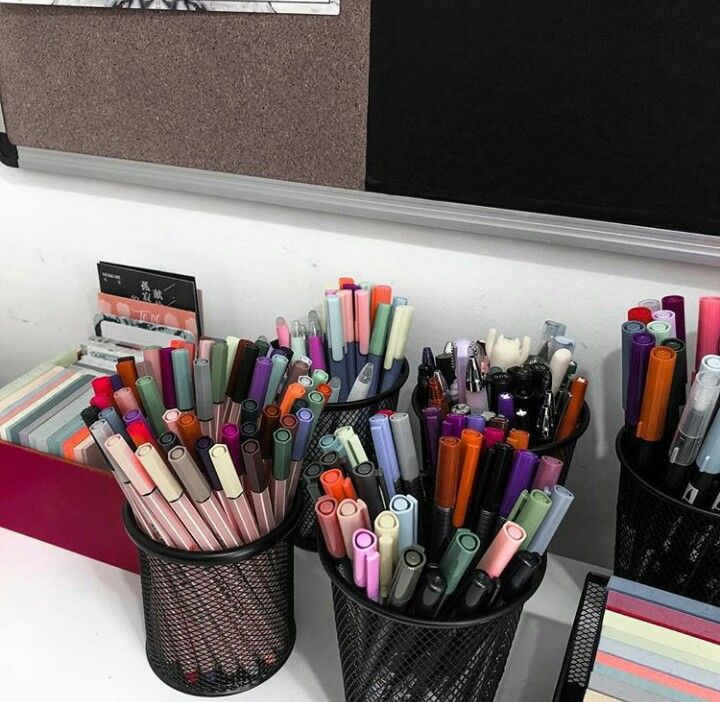
Find the location of a particular element. This screenshot has height=702, width=720. pin board is located at coordinates (253, 102).